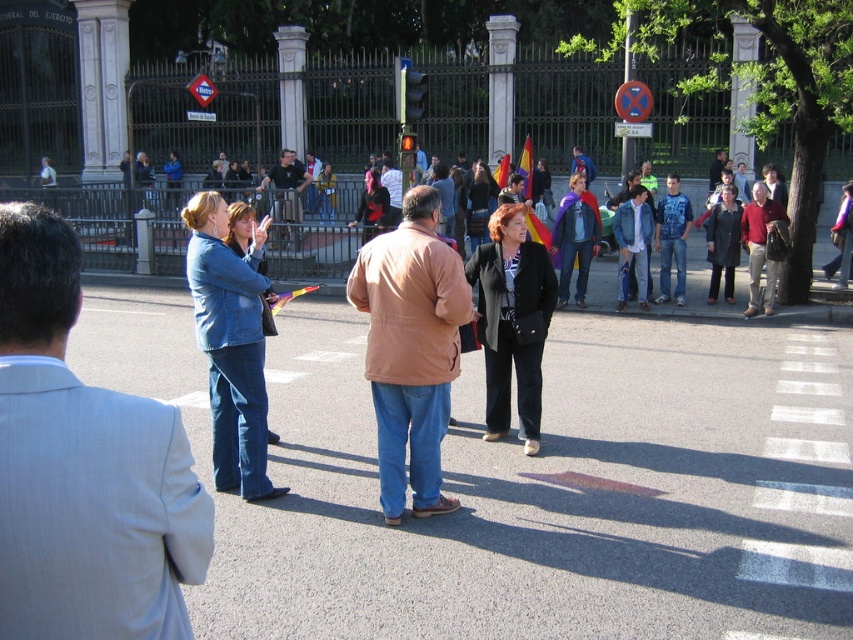
You are standing at the center of the street and see the light blue denim jeans at center. Can you tell me what object is located exactly at the point with coordinates [83,468]?

The light blue denim jeans at center is located exactly at the point with coordinates [83,468].

You are a tailor who needs to determine if the light blue denim jeans at center can fit inside the brown leather jacket at center. Based on the scene description, can the jeans fit inside the jacket?

The light blue denim jeans at center is thinner than the brown leather jacket at center, so it is possible that the jeans could fit inside the jacket if the jacket has enough space. However, the scene does not provide information about the jacket pockets or storage capacity, so this is speculative.